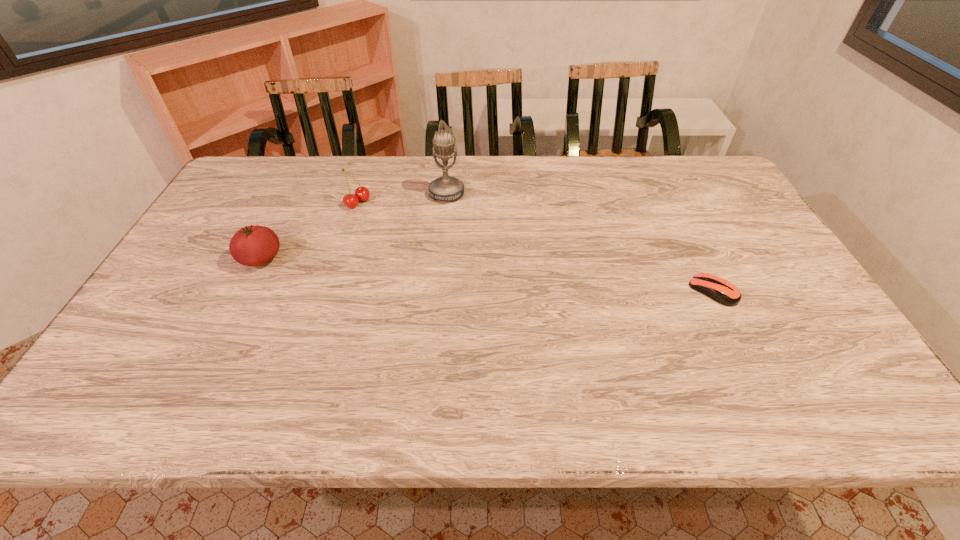
Identify the location of free space on the desktop that is between the third farthest object and the computer mouse and is positioned on the front-facing side of the second object from right to left. (414, 269).

This screenshot has height=540, width=960. Identify the location of free space on the desktop that is between the leftmost object and the nearest object and is positioned with the stems of the third object from right to left pointing upwards. (490, 275).